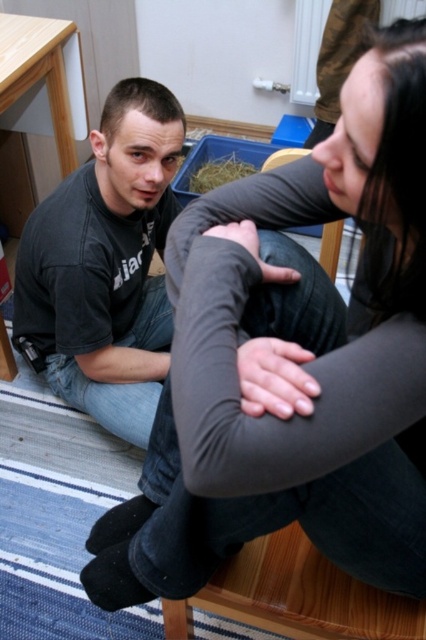
Can you confirm if black cotton shirt at left is smaller than brown straw at center?

Incorrect, black cotton shirt at left is not smaller in size than brown straw at center.

Is black cotton shirt at left bigger than brown straw at center?

Correct, black cotton shirt at left is larger in size than brown straw at center.

Does point (141, 314) come in front of point (198, 179)?

Yes, point (141, 314) is closer to viewer.

Image resolution: width=426 pixels, height=640 pixels. Identify the location of black cotton shirt at left. (104, 266).